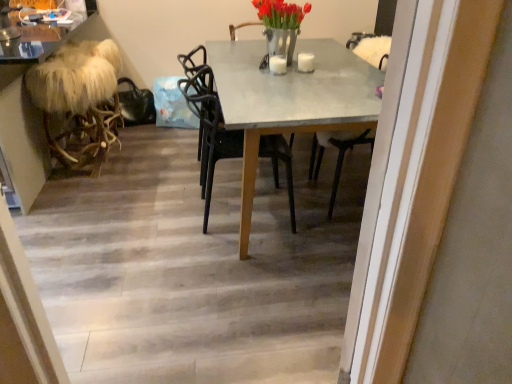
Question: Is metallic silver vase at upper center in front of or behind furry white stool at left in the image?

Choices:
 (A) behind
 (B) front

Answer: (B)

Question: Is point (269, 41) closer or farther from the camera than point (82, 130)?

Choices:
 (A) farther
 (B) closer

Answer: (B)

Question: Considering the real-world distances, which object is closest to the concrete gray table at center?

Choices:
 (A) furry white stool at left
 (B) wooden floor at center
 (C) metallic silver vase at upper center
 (D) black plastic chair at center

Answer: (D)

Question: Based on their relative distances, which object is nearer to the furry white stool at left?

Choices:
 (A) wooden floor at center
 (B) concrete gray table at center
 (C) metallic silver vase at upper center
 (D) black plastic chair at center

Answer: (D)